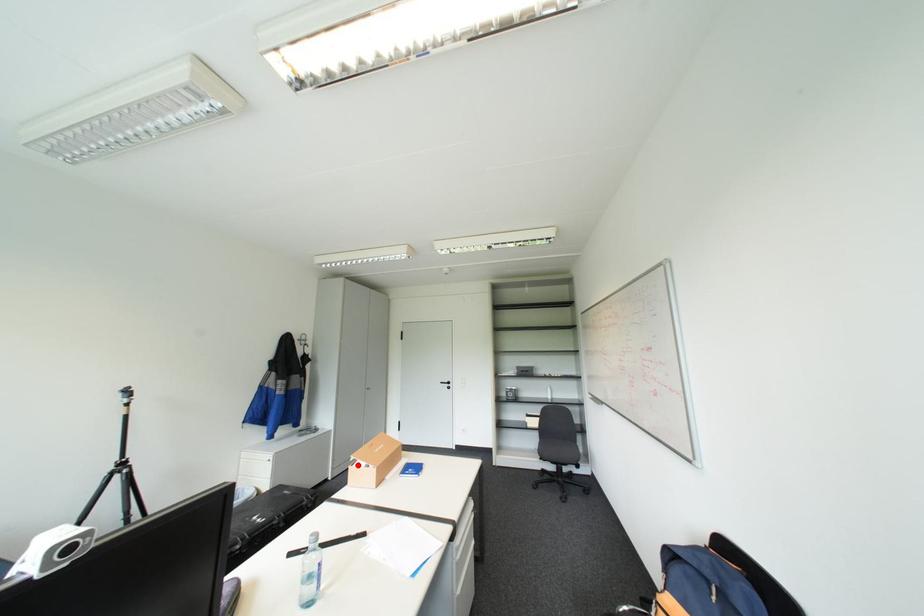
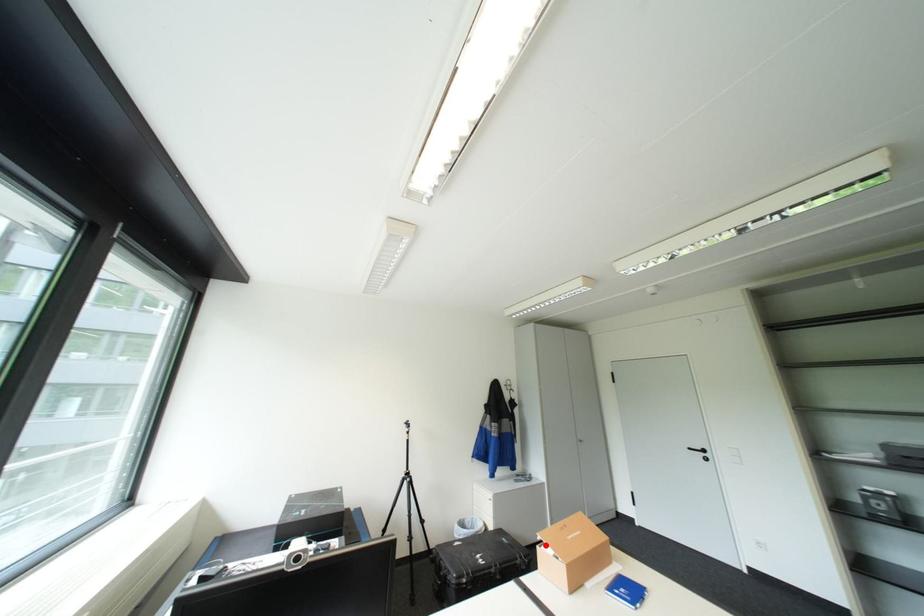
I am providing you with two images of the same scene from different viewpoints. A red point is marked on the first image and another point is marked on the second image. Is the marked point in image1 the same physical position as the marked point in image2?

Yes